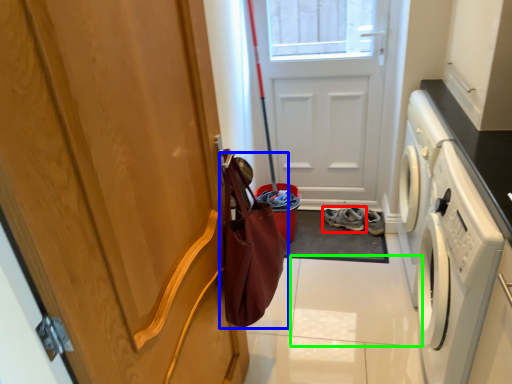
Question: Based on their relative distances, which object is farther from footwear (highlighted by a red box)? Choose from shopping bag (highlighted by a blue box) and tile (highlighted by a green box).

Choices:
 (A) shopping bag
 (B) tile

Answer: (A)